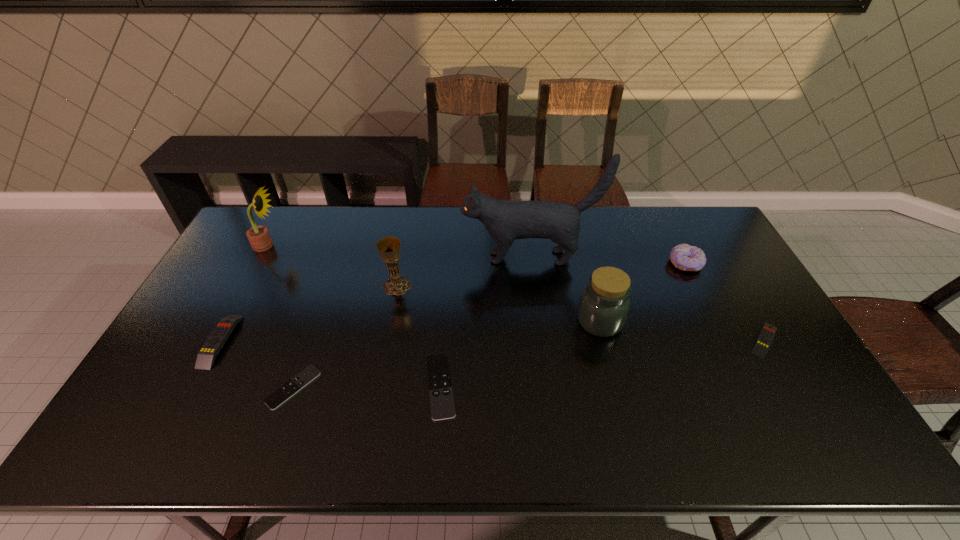
The image size is (960, 540). I want to click on the fourth shortest object, so click(x=206, y=356).

I want to click on the second tallest remote control, so click(763, 342).

Locate an element on the screen. Image resolution: width=960 pixels, height=540 pixels. the smaller yellow remote control is located at coordinates (763, 342).

In order to click on the third tallest remote control in this screenshot , I will do [442, 405].

Find the location of a particular element. Image resolution: width=960 pixels, height=540 pixels. the second remote control from right to left is located at coordinates (442, 405).

Where is `the second remote control from left to right`? The width and height of the screenshot is (960, 540). the second remote control from left to right is located at coordinates (286, 391).

Where is `the shortest remote control`? The image size is (960, 540). the shortest remote control is located at coordinates (286, 391).

Locate an element on the screen. blank area located 0.340m at the face of the gray cat is located at coordinates (362, 258).

Where is `vacant space located 0.400m at the face of the gray cat`? vacant space located 0.400m at the face of the gray cat is located at coordinates (345, 258).

The height and width of the screenshot is (540, 960). Find the location of `free point located 0.070m at the face of the gray cat`. free point located 0.070m at the face of the gray cat is located at coordinates (442, 258).